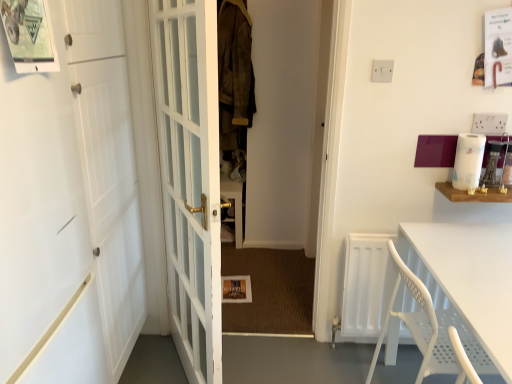
What do you see at coordinates (468, 161) in the screenshot? I see `white paper towel at upper right` at bounding box center [468, 161].

This screenshot has height=384, width=512. In order to click on white plastic table at lower right in this screenshot , I will do `click(467, 278)`.

The height and width of the screenshot is (384, 512). What do you see at coordinates (467, 278) in the screenshot? I see `white plastic table at lower right` at bounding box center [467, 278].

Where is `white glass door at center, placed as the 1th door when sorted from right to left`? The height and width of the screenshot is (384, 512). white glass door at center, placed as the 1th door when sorted from right to left is located at coordinates (190, 177).

Locate an element on the screen. This screenshot has height=384, width=512. suede jacket at center is located at coordinates (234, 80).

Consider the image. Is white glass door at center, acting as the 2th door starting from the left, far away from white plastic table at lower right?

No, white glass door at center, acting as the 2th door starting from the left, is not far from white plastic table at lower right.

Is white glass door at center, placed as the 1th door when sorted from right to left, facing towards white plastic table at lower right?

Yes, white glass door at center, placed as the 1th door when sorted from right to left, is turned towards white plastic table at lower right.

Can you confirm if white glass door at center, acting as the 2th door starting from the left, is shorter than white plastic table at lower right?

No, white glass door at center, acting as the 2th door starting from the left, is not shorter than white plastic table at lower right.

From the image's perspective, which one is positioned lower, white plastic table at lower right or white matte door at left, placed as the second door when sorted from right to left?

white plastic table at lower right, from the image's perspective.

Can you confirm if white plastic table at lower right is thinner than white matte door at left, marked as the 1th door in a left-to-right arrangement?

No, white plastic table at lower right is not thinner than white matte door at left, marked as the 1th door in a left-to-right arrangement.

From a real-world perspective, count 1st doors upward from the white plastic table at lower right and point to it. Please provide its 2D coordinates.

[(69, 207)]

Which object is more forward, white plastic table at lower right or white matte door at left, marked as the 1th door in a left-to-right arrangement?

white matte door at left, marked as the 1th door in a left-to-right arrangement, is more forward.

Which of these two, white plastic table at lower right or suede jacket at center, is thinner?

suede jacket at center is thinner.

Would you say white plastic table at lower right is inside or outside suede jacket at center?

white plastic table at lower right is located beyond the bounds of suede jacket at center.

Where is `table directly beneath the suede jacket at center (from a real-world perspective)`? Image resolution: width=512 pixels, height=384 pixels. table directly beneath the suede jacket at center (from a real-world perspective) is located at coordinates (467, 278).

Is suede jacket at center smaller than white paper towel at upper right?

Actually, suede jacket at center might be larger than white paper towel at upper right.

Identify the location of laundry behind the white paper towel at upper right. The image size is (512, 384). (234, 80).

From a real-world perspective, does suede jacket at center sit lower than white paper towel at upper right?

Incorrect, from a real-world perspective, suede jacket at center is higher than white paper towel at upper right.

Who is shorter, suede jacket at center or white paper towel at upper right?

white paper towel at upper right.

Is suede jacket at center facing towards white plastic table at lower right?

No.

Is point (234, 71) closer or farther from the camera than point (490, 312)?

Point (234, 71) is positioned farther from the camera compared to point (490, 312).

Which object is positioned more to the left, suede jacket at center or white plastic table at lower right?

suede jacket at center.

Considering the sizes of objects suede jacket at center and white plastic table at lower right in the image provided, who is shorter, suede jacket at center or white plastic table at lower right?

Standing shorter between the two is white plastic table at lower right.

From a real-world perspective, who is located higher, white plastic table at lower right or white glass door at center, placed as the 1th door when sorted from right to left?

white glass door at center, placed as the 1th door when sorted from right to left.

Is white plastic table at lower right smaller than white glass door at center, acting as the 2th door starting from the left?

Indeed, white plastic table at lower right has a smaller size compared to white glass door at center, acting as the 2th door starting from the left.

In the scene shown: Is white plastic table at lower right in contact with white glass door at center, acting as the 2th door starting from the left?

They are not placed beside each other.

Does white glass door at center, placed as the 1th door when sorted from right to left, come behind white matte door at left, placed as the second door when sorted from right to left?

No, the depth of white glass door at center, placed as the 1th door when sorted from right to left, is less than that of white matte door at left, placed as the second door when sorted from right to left.

Is white glass door at center, placed as the 1th door when sorted from right to left, spatially inside white matte door at left, marked as the 1th door in a left-to-right arrangement, or outside of it?

white glass door at center, placed as the 1th door when sorted from right to left, is located beyond the bounds of white matte door at left, marked as the 1th door in a left-to-right arrangement.

This screenshot has width=512, height=384. What are the coordinates of `door below the white glass door at center, acting as the 2th door starting from the left (from a real-world perspective)` in the screenshot? It's located at [69, 207].

In the scene shown: Could you tell me if white glass door at center, placed as the 1th door when sorted from right to left, is turned towards white matte door at left, marked as the 1th door in a left-to-right arrangement?

Yes, white glass door at center, placed as the 1th door when sorted from right to left, is facing white matte door at left, marked as the 1th door in a left-to-right arrangement.

Identify the location of the 1st door to the left of the white plastic table at lower right, counting from the anchor's position. [190, 177].

I want to click on table that appears below the white matte door at left, marked as the 1th door in a left-to-right arrangement (from the image's perspective), so click(x=467, y=278).

Looking at the image, which one is located closer to suede jacket at center, white glass door at center, placed as the 1th door when sorted from right to left, or white paper towel at upper right?

white glass door at center, placed as the 1th door when sorted from right to left.

Looking at this image, when comparing their distances from white matte door at left, marked as the 1th door in a left-to-right arrangement, does suede jacket at center or white plastic table at lower right seem further?

white plastic table at lower right.

From the image, which object appears to be nearer to white glass door at center, acting as the 2th door starting from the left, suede jacket at center or white plastic table at lower right?

white plastic table at lower right.

From the image, which object appears to be nearer to white glass door at center, placed as the 1th door when sorted from right to left, white plastic table at lower right or white paper towel at upper right?

white plastic table at lower right is closer to white glass door at center, placed as the 1th door when sorted from right to left.

Which object lies nearer to the anchor point white paper towel at upper right, suede jacket at center or white plastic table at lower right?

white plastic table at lower right is positioned closer to the anchor white paper towel at upper right.

Considering their positions, is suede jacket at center positioned closer to white plastic table at lower right than white matte door at left, placed as the second door when sorted from right to left?

white matte door at left, placed as the second door when sorted from right to left, is positioned closer to the anchor white plastic table at lower right.

Considering their positions, is white paper towel at upper right positioned closer to suede jacket at center than white matte door at left, marked as the 1th door in a left-to-right arrangement?

white matte door at left, marked as the 1th door in a left-to-right arrangement, is positioned closer to the anchor suede jacket at center.

Based on their spatial positions, is white paper towel at upper right or suede jacket at center further from white matte door at left, placed as the second door when sorted from right to left?

white paper towel at upper right lies further to white matte door at left, placed as the second door when sorted from right to left, than the other object.

At what (x,y) coordinates should I click in order to perform the action: click on laundry situated between white matte door at left, placed as the second door when sorted from right to left, and white plastic table at lower right from left to right. Please return your answer as a coordinate pair (x, y). This screenshot has width=512, height=384. Looking at the image, I should click on (234, 80).

This screenshot has width=512, height=384. What are the coordinates of `laundry located between white matte door at left, marked as the 1th door in a left-to-right arrangement, and white paper towel at upper right in the left-right direction` in the screenshot? It's located at (234, 80).

At what (x,y) coordinates should I click in order to perform the action: click on door between white matte door at left, marked as the 1th door in a left-to-right arrangement, and white plastic table at lower right, in the horizontal direction. Please return your answer as a coordinate pair (x, y). Image resolution: width=512 pixels, height=384 pixels. Looking at the image, I should click on (190, 177).

The image size is (512, 384). Identify the location of door situated between white matte door at left, marked as the 1th door in a left-to-right arrangement, and white paper towel at upper right from left to right. (190, 177).